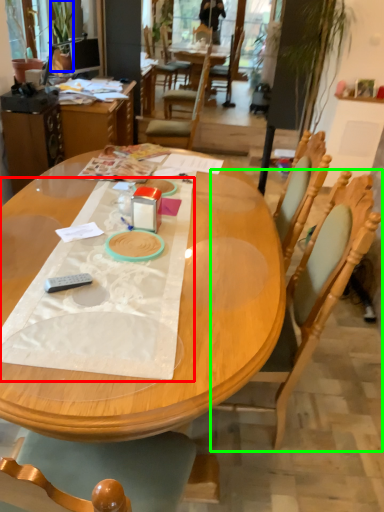
Question: Which is farther away from sheet (highlighted by a red box)? houseplant (highlighted by a blue box) or chair (highlighted by a green box)?

Choices:
 (A) houseplant
 (B) chair

Answer: (A)